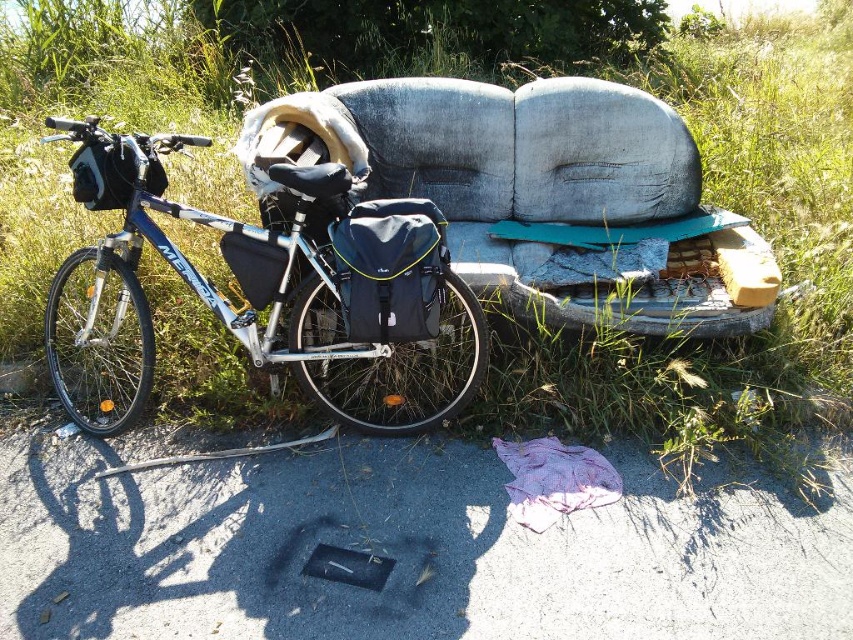
Does green grass at upper left have a smaller size compared to blue metallic bicycle at left?

No.

Measure the distance between point (677, 294) and camera.

They are 9.62 feet apart.

At what (x,y) coordinates should I click in order to perform the action: click on green grass at upper left. Please return your answer as a coordinate pair (x, y). This screenshot has height=640, width=853. Looking at the image, I should click on (572, 208).

Can you confirm if worn fabric couch at center is thinner than blue metallic bicycle at left?

Incorrect, worn fabric couch at center's width is not less than blue metallic bicycle at left's.

Is point (544, 196) behind point (409, 304)?

Yes, point (544, 196) is farther from viewer.

Is point (732, 237) less distant than point (300, 340)?

No, it is behind (300, 340).

The width and height of the screenshot is (853, 640). What are the coordinates of `worn fabric couch at center` in the screenshot? It's located at (538, 195).

Between point (425, 125) and point (764, 292), which one is positioned in front?

Point (764, 292) is in front.

Which is above, green grass at upper left or worn fabric couch at center?

green grass at upper left is higher up.

Describe the element at coordinates (572, 208) in the screenshot. I see `green grass at upper left` at that location.

Locate an element on the screen. This screenshot has height=640, width=853. green grass at upper left is located at coordinates [572, 208].